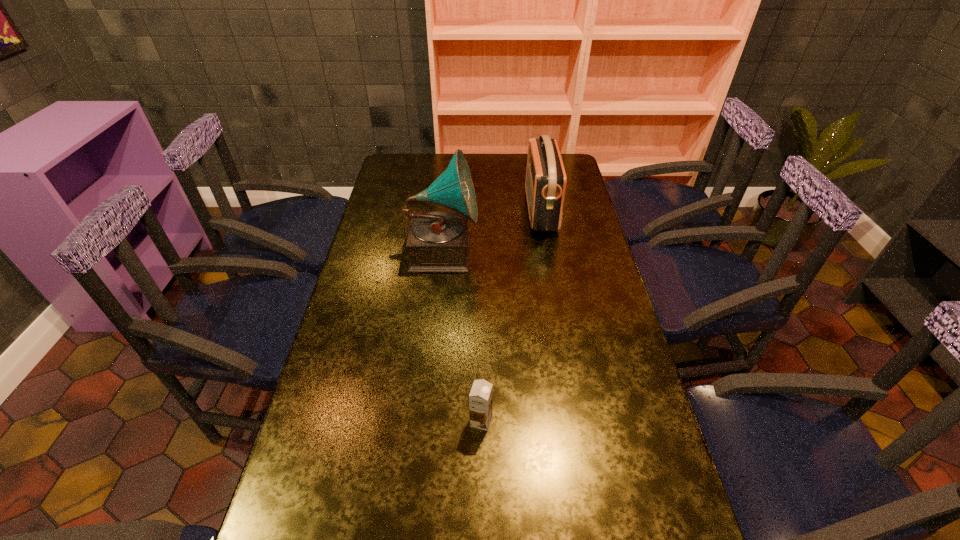
Locate an element on the screen. This screenshot has height=540, width=960. object that is the closest one to the record player is located at coordinates (545, 184).

In order to click on vacant space that satisfies the following two spatial constraints: 1. on the front-facing side of the rightmost object; 2. on the front side of the nearest object in this screenshot , I will do `click(578, 421)`.

The width and height of the screenshot is (960, 540). What are the coordinates of `free space that satisfies the following two spatial constraints: 1. on the front-facing side of the second shortest object; 2. on the front side of the nearest object` in the screenshot? It's located at (578, 421).

Identify the location of free location that satisfies the following two spatial constraints: 1. on the back side of the shortest object; 2. on the horn of the tallest object. (481, 251).

At what (x,y) coordinates should I click in order to perform the action: click on free space that satisfies the following two spatial constraints: 1. on the back side of the chocolate milk; 2. on the horn of the tallest object. Please return your answer as a coordinate pair (x, y). Looking at the image, I should click on (481, 251).